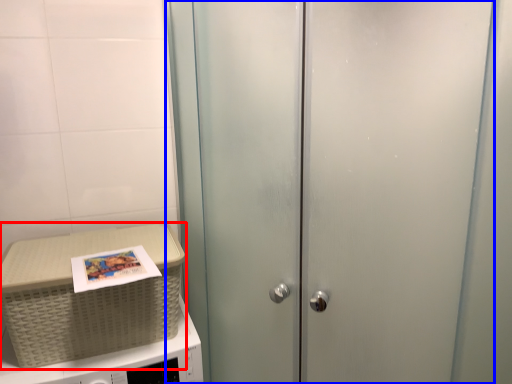
Question: Among these objects, which one is nearest to the camera, picnic basket (highlighted by a red box) or door (highlighted by a blue box)?

Choices:
 (A) picnic basket
 (B) door

Answer: (B)